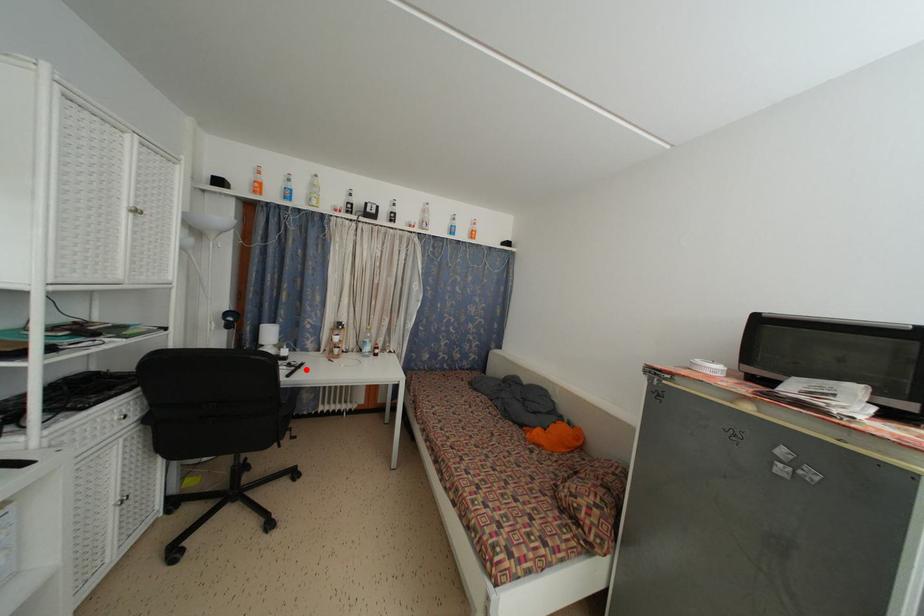
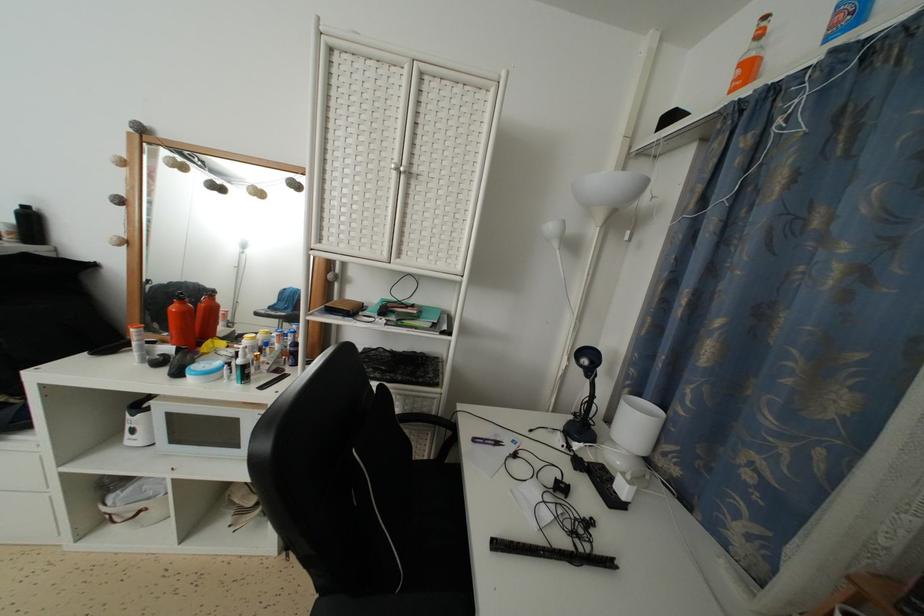
The point at the highlighted location is marked in the first image. Where is the corresponding point in the second image?

(614, 569)